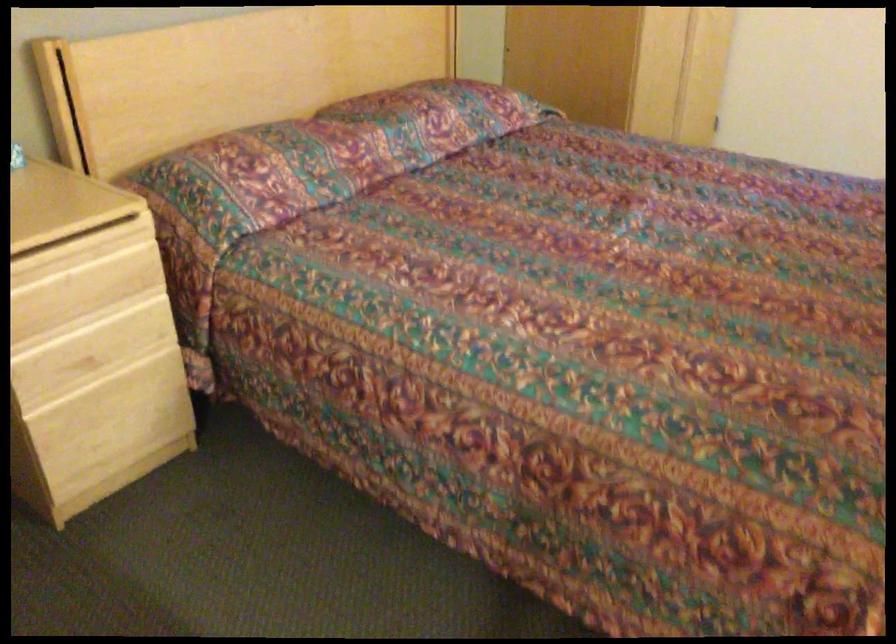
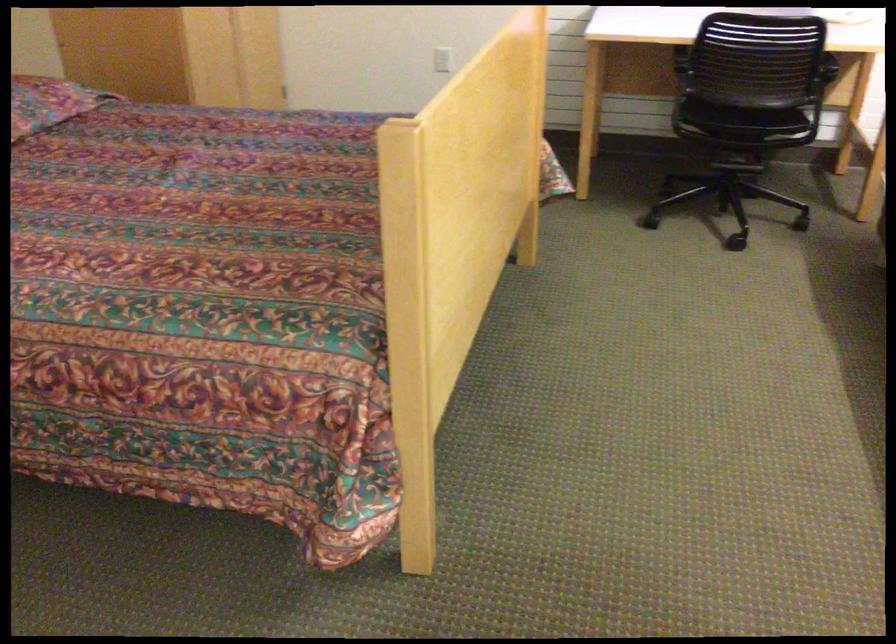
Question: The images are taken continuously from a first-person perspective. In which direction is your viewpoint rotating?

Choices:
 (A) Left
 (B) Right
 (C) Up
 (D) Down

Answer: (B)